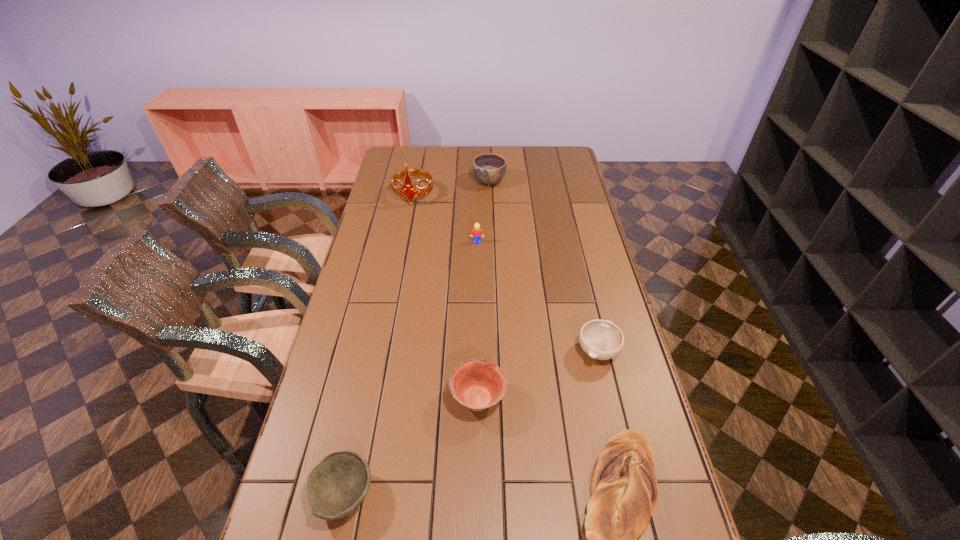
Where is `free spot located on the front-facing side of the Lego`? The image size is (960, 540). free spot located on the front-facing side of the Lego is located at coordinates (476, 319).

Find the location of a particular element. free space located on the left of the fifth farthest object is located at coordinates (327, 399).

You are a GUI agent. You are given a task and a screenshot of the screen. Output one action in this format:
    pyautogui.click(x=<x>, y=<y>)
    Task: Click on the vacant space positioned on the left of the rightmost bowl
    The image size is (960, 540).
    Given the screenshot: What is the action you would take?
    pyautogui.click(x=553, y=351)

Locate an element on the screen. vacant space located on the back of the nearest bowl is located at coordinates (360, 416).

You are a GUI agent. You are given a task and a screenshot of the screen. Output one action in this format:
    pyautogui.click(x=<x>, y=<y>)
    Task: Click on the tiara that is at the left edge
    
    Given the screenshot: What is the action you would take?
    pyautogui.click(x=409, y=191)

I want to click on bowl situated at the left edge, so click(335, 487).

Identify the location of object located at the right edge. (600, 339).

In the image, there is a desktop. Where is `vacant space at the far edge`? Image resolution: width=960 pixels, height=540 pixels. vacant space at the far edge is located at coordinates (515, 162).

You are a GUI agent. You are given a task and a screenshot of the screen. Output one action in this format:
    pyautogui.click(x=<x>, y=<y>)
    Task: Click on the free space at the left edge of the desktop
    The width and height of the screenshot is (960, 540).
    Given the screenshot: What is the action you would take?
    pyautogui.click(x=382, y=320)

Locate an element on the screen. free space at the right edge of the desktop is located at coordinates (560, 232).